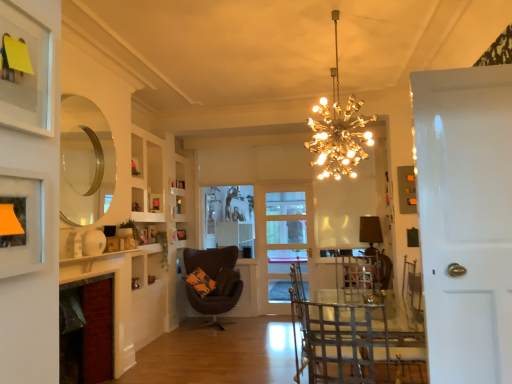
Question: Does red brick fireplace at lower left have a larger size compared to gold metallic chandelier at upper center?

Choices:
 (A) no
 (B) yes

Answer: (A)

Question: Can you confirm if red brick fireplace at lower left is positioned to the left of gold metallic chandelier at upper center?

Choices:
 (A) no
 (B) yes

Answer: (B)

Question: Is there a large distance between red brick fireplace at lower left and gold metallic chandelier at upper center?

Choices:
 (A) no
 (B) yes

Answer: (B)

Question: Is the position of red brick fireplace at lower left more distant than that of gold metallic chandelier at upper center?

Choices:
 (A) no
 (B) yes

Answer: (B)

Question: Is red brick fireplace at lower left not within gold metallic chandelier at upper center?

Choices:
 (A) no
 (B) yes

Answer: (B)

Question: In the image, is red brick fireplace at lower left positioned in front of or behind matte gray picture frame at upper right, marked as the 1th picture frame in a right-to-left arrangement?

Choices:
 (A) front
 (B) behind

Answer: (A)

Question: Is red brick fireplace at lower left wider or thinner than matte gray picture frame at upper right, arranged as the fourth picture frame when viewed from the back?

Choices:
 (A) wide
 (B) thin

Answer: (A)

Question: In terms of size, does red brick fireplace at lower left appear bigger or smaller than matte gray picture frame at upper right, marked as the 1th picture frame in a right-to-left arrangement?

Choices:
 (A) small
 (B) big

Answer: (B)

Question: Would you say red brick fireplace at lower left is inside or outside matte gray picture frame at upper right, which appears as the second picture frame when viewed from the front?

Choices:
 (A) inside
 (B) outside

Answer: (B)

Question: From a real-world perspective, is matte black picture frame at upper left, which is counted as the 1th picture frame, starting from the front, positioned above or below clear glass mirror at upper left?

Choices:
 (A) below
 (B) above

Answer: (A)

Question: In the image, is matte black picture frame at upper left, which is the second picture frame in right-to-left order, positioned in front of or behind clear glass mirror at upper left?

Choices:
 (A) front
 (B) behind

Answer: (A)

Question: Would you say matte black picture frame at upper left, which is counted as the 1th picture frame, starting from the front, is to the left or to the right of clear glass mirror at upper left in the picture?

Choices:
 (A) left
 (B) right

Answer: (B)

Question: Is matte black picture frame at upper left, positioned as the 5th picture frame in back-to-front order, situated inside clear glass mirror at upper left or outside?

Choices:
 (A) inside
 (B) outside

Answer: (B)

Question: From the image's perspective, relative to red brick fireplace at lower left, is matte black picture frame at upper left, which is counted as the fourth picture frame, starting from the left, above or below?

Choices:
 (A) below
 (B) above

Answer: (B)

Question: Considering the positions of matte black picture frame at upper left, which is counted as the 1th picture frame, starting from the front, and red brick fireplace at lower left in the image, is matte black picture frame at upper left, which is counted as the 1th picture frame, starting from the front, bigger or smaller than red brick fireplace at lower left?

Choices:
 (A) big
 (B) small

Answer: (B)